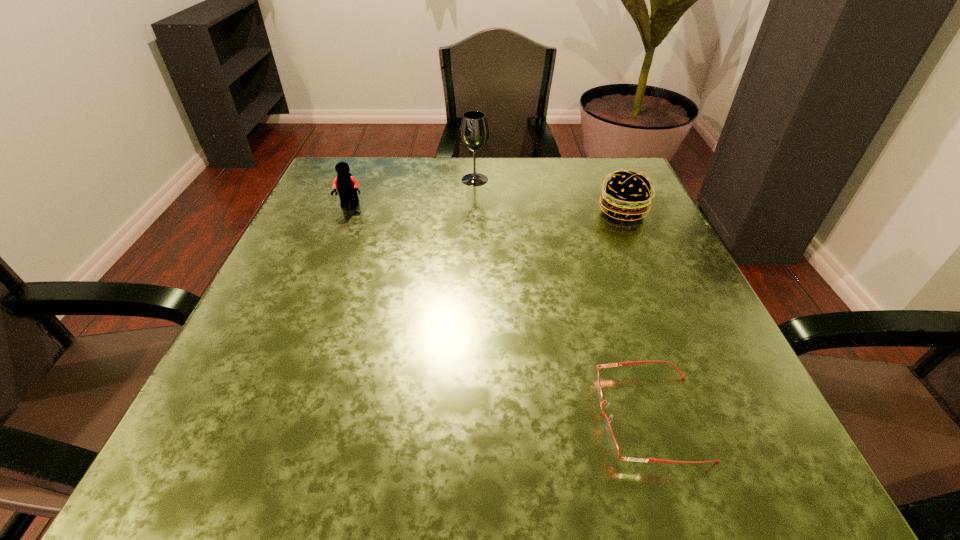
Choose which object is the nearest neighbor to the patty. Please provide its 2D coordinates. Your answer should be formatted as a tuple, i.e. [(x, y)], where the tuple contains the x and y coordinates of a point satisfying the conditions above.

[(474, 132)]

Find the location of a particular element. This screenshot has width=960, height=540. free space that satisfies the following two spatial constraints: 1. on the front-facing side of the leftmost object; 2. on the left side of the patty is located at coordinates (348, 211).

At what (x,y) coordinates should I click in order to perform the action: click on vacant space that satisfies the following two spatial constraints: 1. on the front-facing side of the Lego; 2. on the left side of the patty. Please return your answer as a coordinate pair (x, y). Looking at the image, I should click on (348, 211).

Where is `vacant space that satisfies the following two spatial constraints: 1. on the front-facing side of the Lego; 2. on the left side of the patty`? vacant space that satisfies the following two spatial constraints: 1. on the front-facing side of the Lego; 2. on the left side of the patty is located at coordinates (348, 211).

You are a GUI agent. You are given a task and a screenshot of the screen. Output one action in this format:
    pyautogui.click(x=<x>, y=<y>)
    Task: Click on the free location that satisfies the following two spatial constraints: 1. on the front-facing side of the leftmost object; 2. on the right side of the patty
    Image resolution: width=960 pixels, height=540 pixels.
    Given the screenshot: What is the action you would take?
    pyautogui.click(x=348, y=211)

This screenshot has width=960, height=540. What are the coordinates of `vacant space that satisfies the following two spatial constraints: 1. on the front side of the patty; 2. on the lenses of the nearest object` in the screenshot? It's located at (711, 417).

At what (x,y) coordinates should I click in order to perform the action: click on free spot that satisfies the following two spatial constraints: 1. on the front-facing side of the patty; 2. on the right side of the leftmost object. Please return your answer as a coordinate pair (x, y). This screenshot has width=960, height=540. Looking at the image, I should click on (348, 211).